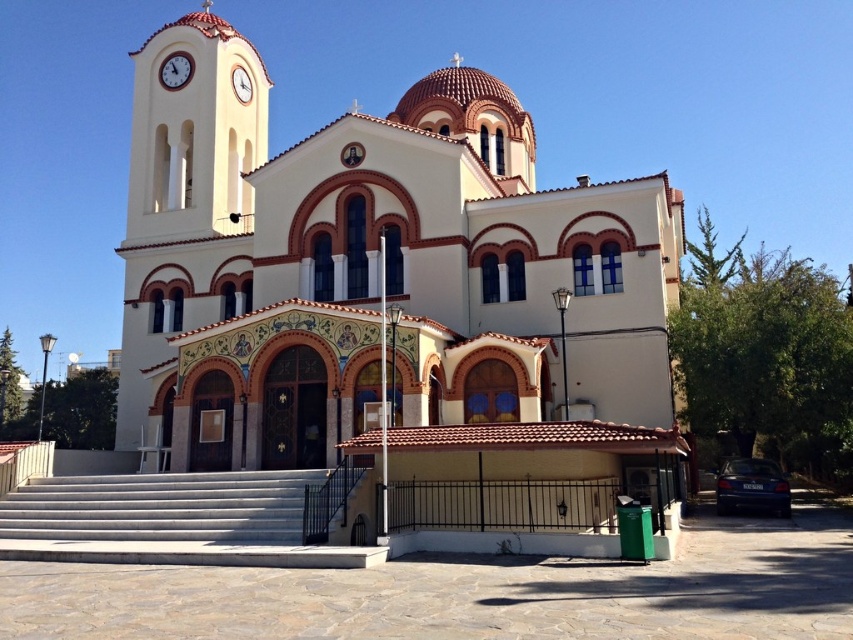
Question: Which object is positioned closest to the white concrete stairs at lower left?

Choices:
 (A) gold metallic clock at upper center
 (B) white stucco bell tower at upper left
 (C) white glossy clock at upper left
 (D) white painted stone church at center

Answer: (B)

Question: Which of the following is the closest to the observer?

Choices:
 (A) (242, 541)
 (B) (223, 465)
 (C) (239, 93)

Answer: (A)

Question: Does white stucco bell tower at upper left appear on the left side of gold metallic clock at upper center?

Choices:
 (A) yes
 (B) no

Answer: (A)

Question: Which point is closer to the camera?

Choices:
 (A) (86, 508)
 (B) (248, 80)

Answer: (A)

Question: Is white painted stone church at center bigger than white stucco bell tower at upper left?

Choices:
 (A) yes
 (B) no

Answer: (A)

Question: Does white painted stone church at center have a lesser width compared to white glossy clock at upper left?

Choices:
 (A) yes
 (B) no

Answer: (B)